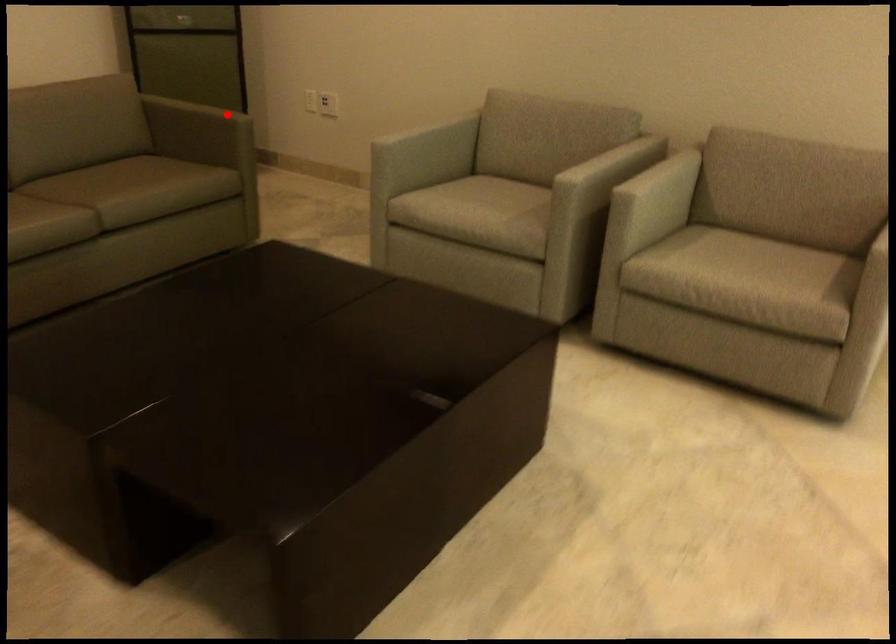
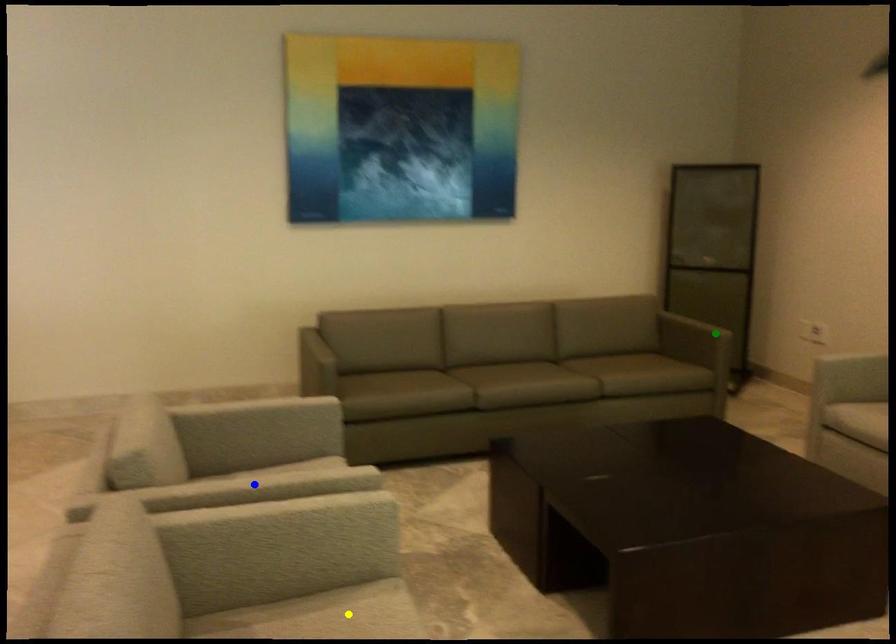
Question: I am providing you with two images of the same scene from different viewpoints. A red point is marked on the first image. You are given multiple points on the second image. Which point in image 2 represents the same 3d spot as the red point in image 1?

Choices:
 (A) blue point
 (B) green point
 (C) yellow point

Answer: (B)